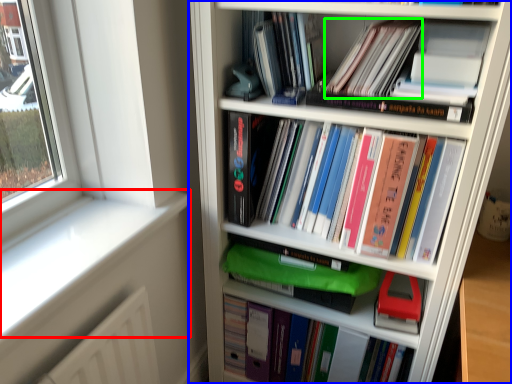
Question: Estimate the real-world distances between objects in this image. Which object is farther from window sill (highlighted by a red box), bookcase (highlighted by a blue box) or book (highlighted by a green box)?

Choices:
 (A) bookcase
 (B) book

Answer: (B)